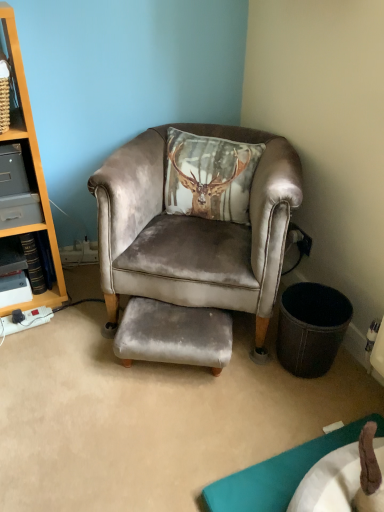
Measure the distance between velvet grey footrest at center and camera.

velvet grey footrest at center and camera are 1.40 meters apart.

At what (x,y) coordinates should I click in order to perform the action: click on velvet grey chair at center. Please return your answer as a coordinate pair (x, y). Image resolution: width=384 pixels, height=512 pixels. Looking at the image, I should click on (194, 231).

At what (x,y) coordinates should I click in order to perform the action: click on chair that is above the velvet grey footrest at center (from a real-world perspective). Please return your answer as a coordinate pair (x, y). Looking at the image, I should click on (194, 231).

Is point (212, 222) positioned before point (214, 367)?

No, (212, 222) is behind (214, 367).

Looking at their sizes, would you say velvet grey chair at center is wider or thinner than velvet grey footrest at center?

Considering their sizes, velvet grey chair at center looks broader than velvet grey footrest at center.

From the image's perspective, which is above, velvet grey footrest at center or gray plastic drawer at left?

gray plastic drawer at left, from the image's perspective.

Based on the photo, from a real-world perspective, between velvet grey footrest at center and gray plastic drawer at left, who is vertically higher?

gray plastic drawer at left.

Can you confirm if velvet grey footrest at center is smaller than gray plastic drawer at left?

No, velvet grey footrest at center is not smaller than gray plastic drawer at left.

Which point is more forward, (121, 356) or (9, 199)?

Point (121, 356)

Can you tell me how much gray plastic drawer at left and velvet grey footrest at center differ in facing direction?

There is a 30.2-degree angle between the facing directions of gray plastic drawer at left and velvet grey footrest at center.

In the image, is gray plastic drawer at left positioned in front of or behind velvet grey footrest at center?

Clearly, gray plastic drawer at left is behind velvet grey footrest at center.

From a real-world perspective, who is located lower, gray plastic drawer at left or velvet grey footrest at center?

velvet grey footrest at center is physically lower.

Are velvet grey footrest at center and velvet grey chair at center beside each other?

They are not placed beside each other.

From the picture: Which of these two, velvet grey footrest at center or velvet grey chair at center, stands taller?

With more height is velvet grey chair at center.

Between velvet grey footrest at center and velvet grey chair at center, which one is positioned behind?

velvet grey footrest at center is further from the camera.

How distant is gray plastic drawer at left from velvet grey chair at center?

21.20 inches.

Is gray plastic drawer at left inside or outside of velvet grey chair at center?

gray plastic drawer at left cannot be found inside velvet grey chair at center.

Consider the image. Between gray plastic drawer at left and velvet grey chair at center, which one appears on the left side from the viewer's perspective?

From the viewer's perspective, gray plastic drawer at left appears more on the left side.

Is point (1, 223) farther from camera compared to point (240, 269)?

Yes.

Could you tell me if velvet grey chair at center is turned towards gray plastic drawer at left?

No, velvet grey chair at center is not facing towards gray plastic drawer at left.

Based on the photo, which is more to the left, velvet grey chair at center or gray plastic drawer at left?

From the viewer's perspective, gray plastic drawer at left appears more on the left side.

From the picture: Does velvet grey chair at center have a smaller size compared to gray plastic drawer at left?

No.

Are velvet grey chair at center and gray plastic drawer at left located far from each other?

That's not correct — velvet grey chair at center is a little close to gray plastic drawer at left.

The height and width of the screenshot is (512, 384). In order to click on chair above the velvet grey footrest at center (from a real-world perspective) in this screenshot , I will do `click(194, 231)`.

Identify the location of the footrest in front of the gray plastic drawer at left. The image size is (384, 512). (174, 335).

Looking at the image, which one is located closer to velvet grey footrest at center, gray plastic drawer at left or velvet grey chair at center?

velvet grey chair at center lies closer to velvet grey footrest at center than the other object.

Looking at the image, which one is located further to velvet grey chair at center, velvet grey footrest at center or gray plastic drawer at left?

gray plastic drawer at left lies further to velvet grey chair at center than the other object.

Based on their spatial positions, is velvet grey chair at center or gray plastic drawer at left further from velvet grey footrest at center?

Based on the image, gray plastic drawer at left appears to be further to velvet grey footrest at center.

Based on their spatial positions, is velvet grey chair at center or velvet grey footrest at center closer to gray plastic drawer at left?

velvet grey chair at center.

Looking at the image, which one is located closer to velvet grey chair at center, gray plastic drawer at left or velvet grey footrest at center?

velvet grey footrest at center lies closer to velvet grey chair at center than the other object.

When comparing their distances from gray plastic drawer at left, does velvet grey footrest at center or velvet grey chair at center seem further?

velvet grey footrest at center.

Locate an element on the screen. footrest between gray plastic drawer at left and velvet grey chair at center from left to right is located at coordinates click(x=174, y=335).